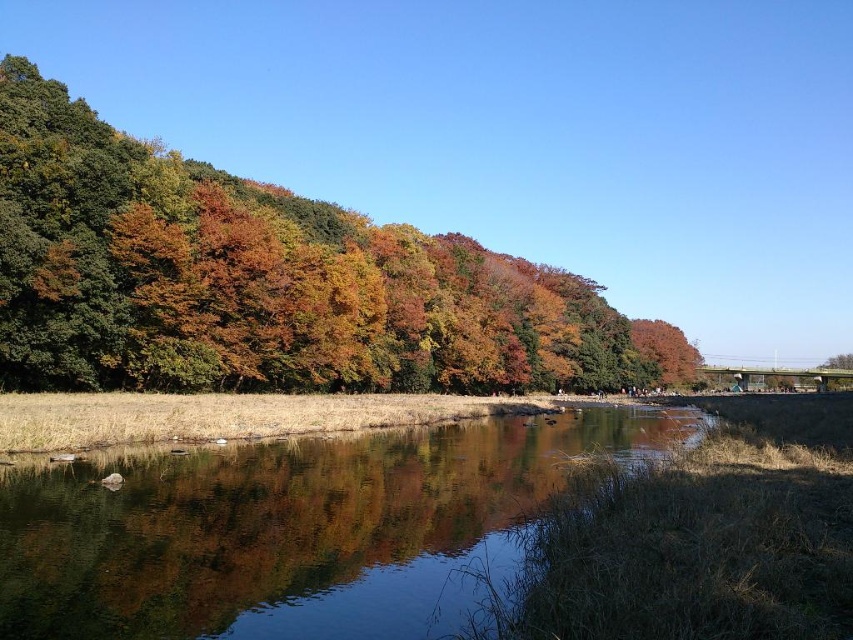
Can you confirm if autumn leaves at upper left is wider than clear water at center?

Yes, autumn leaves at upper left is wider than clear water at center.

Is autumn leaves at upper left taller than clear water at center?

Yes, autumn leaves at upper left is taller than clear water at center.

Between point (161, 152) and point (463, 456), which one is positioned behind?

Point (161, 152)

Identify the location of autumn leaves at upper left. The height and width of the screenshot is (640, 853). (267, 282).